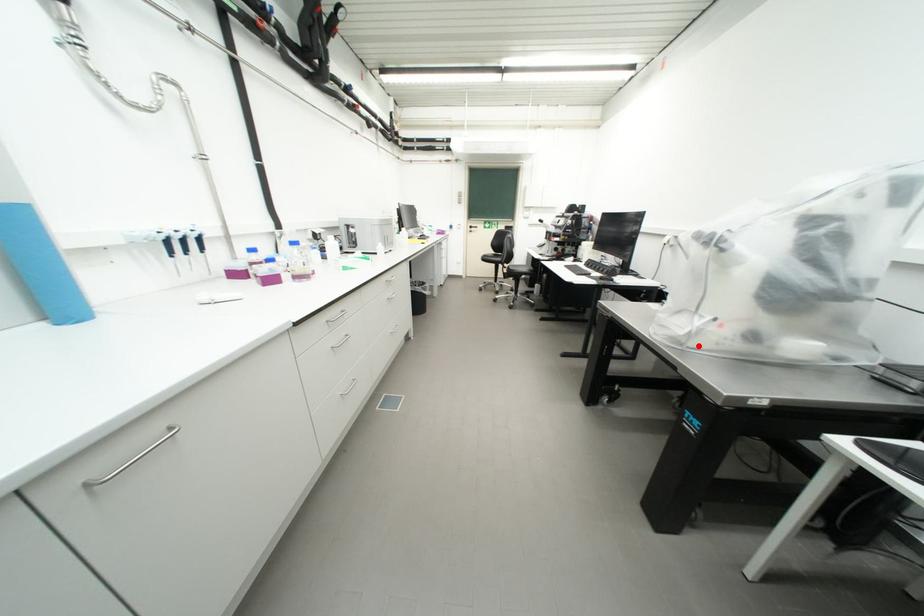
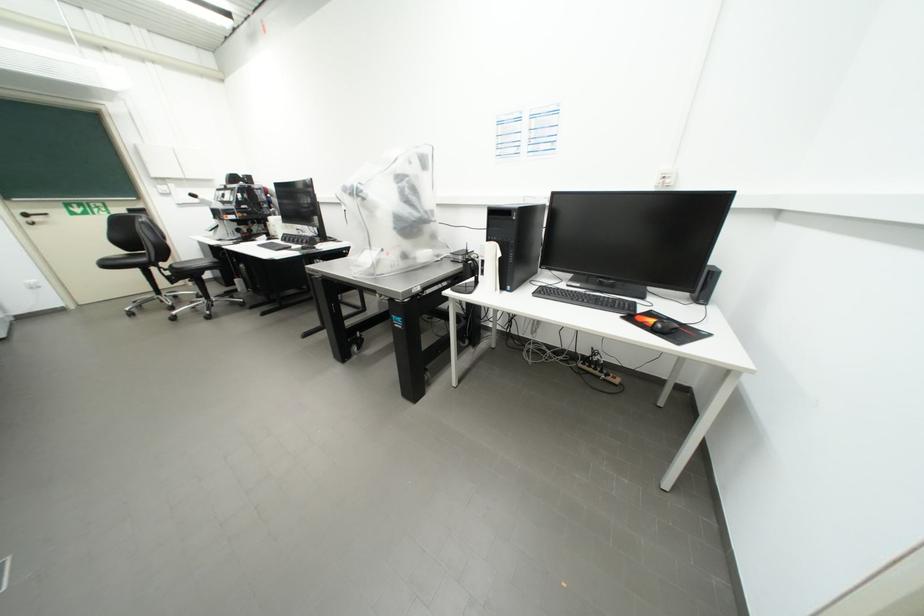
In the second image, find the point that corresponds to the highlighted location in the first image.

(385, 274)